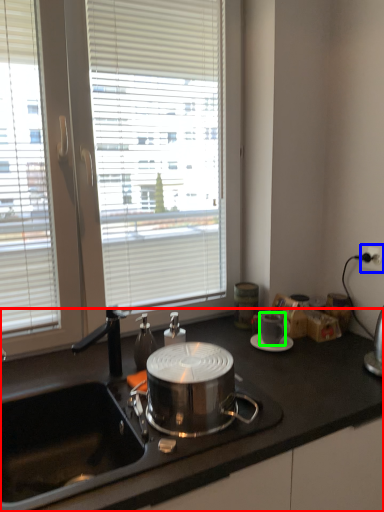
Question: Which object is positioned farthest from countertop (highlighted by a red box)? Select from power outlet (highlighted by a blue box) and coffee cup (highlighted by a green box).

Choices:
 (A) power outlet
 (B) coffee cup

Answer: (A)